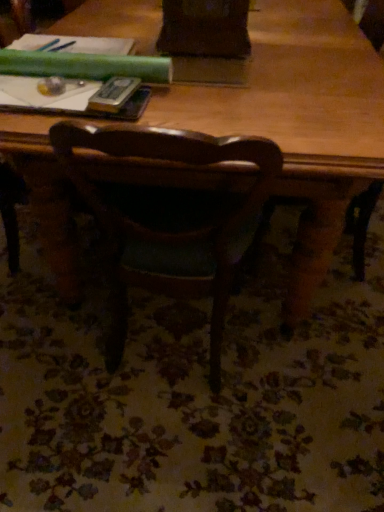
Question: Is hardcover book at upper left bigger than wooden table at center?

Choices:
 (A) yes
 (B) no

Answer: (B)

Question: Is hardcover book at upper left far away from wooden table at center?

Choices:
 (A) no
 (B) yes

Answer: (A)

Question: Is hardcover book at upper left at the right side of wooden table at center?

Choices:
 (A) no
 (B) yes

Answer: (A)

Question: Is hardcover book at upper left next to wooden table at center and touching it?

Choices:
 (A) yes
 (B) no

Answer: (B)

Question: Does hardcover book at upper left have a lesser height compared to wooden table at center?

Choices:
 (A) yes
 (B) no

Answer: (A)

Question: In the image, is hardcover book at upper left on the left side or the right side of wooden table at center?

Choices:
 (A) left
 (B) right

Answer: (A)

Question: In terms of size, does hardcover book at upper left appear bigger or smaller than wooden table at center?

Choices:
 (A) small
 (B) big

Answer: (A)

Question: From the image's perspective, is hardcover book at upper left positioned above or below wooden table at center?

Choices:
 (A) below
 (B) above

Answer: (A)

Question: Considering the positions of hardcover book at upper left and wooden table at center in the image, is hardcover book at upper left wider or thinner than wooden table at center?

Choices:
 (A) wide
 (B) thin

Answer: (B)

Question: Looking at their shapes, would you say wooden table at center is wider or thinner than metallic silver paperback book at upper center?

Choices:
 (A) thin
 (B) wide

Answer: (B)

Question: Considering the relative positions of wooden table at center and metallic silver paperback book at upper center in the image provided, is wooden table at center to the left or to the right of metallic silver paperback book at upper center?

Choices:
 (A) left
 (B) right

Answer: (B)

Question: Is wooden table at center taller or shorter than metallic silver paperback book at upper center?

Choices:
 (A) short
 (B) tall

Answer: (B)

Question: From a real-world perspective, relative to metallic silver paperback book at upper center, is wooden table at center vertically above or below?

Choices:
 (A) above
 (B) below

Answer: (B)

Question: Is point (102, 88) positioned closer to the camera than point (246, 167)?

Choices:
 (A) farther
 (B) closer

Answer: (A)

Question: In terms of height, does metallic silver paperback book at upper center look taller or shorter compared to wooden table at center?

Choices:
 (A) tall
 (B) short

Answer: (B)